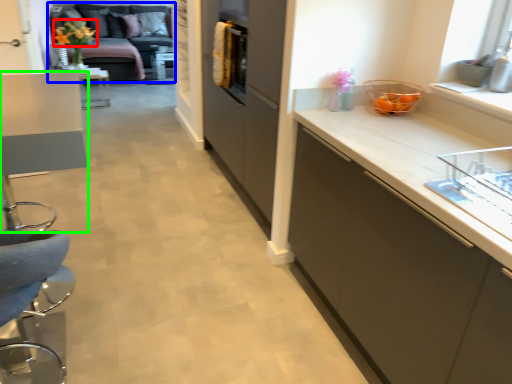
Question: Considering the real-world distances, which object is closest to flower (highlighted by a red box)? studio couch (highlighted by a blue box) or table (highlighted by a green box).

Choices:
 (A) studio couch
 (B) table

Answer: (A)